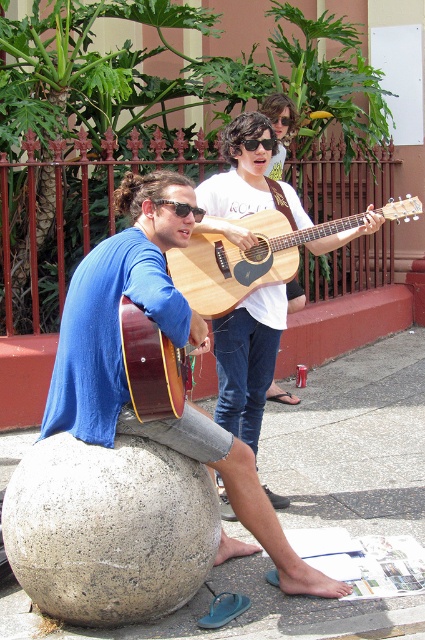
Question: Is gray concrete sphere at lower left to the left of black plastic sunglasses at center from the viewer's perspective?

Choices:
 (A) no
 (B) yes

Answer: (B)

Question: Based on their relative distances, which object is nearer to the natural wood acoustic guitar at center?

Choices:
 (A) gray concrete ball at lower left
 (B) matte blue shirt at left
 (C) natural wood guitar at center
 (D) sunglasses at center

Answer: (C)

Question: Does gray concrete ball at lower left have a larger size compared to black plastic sunglasses at center?

Choices:
 (A) yes
 (B) no

Answer: (A)

Question: Which point is farther to the camera?

Choices:
 (A) (269, 144)
 (B) (175, 204)

Answer: (A)

Question: Which of the following is the closest to the observer?

Choices:
 (A) gray concrete sphere at lower left
 (B) matte blue shirt at left

Answer: (B)

Question: Is the position of gray concrete sphere at lower left less distant than that of natural wood guitar at center?

Choices:
 (A) no
 (B) yes

Answer: (B)